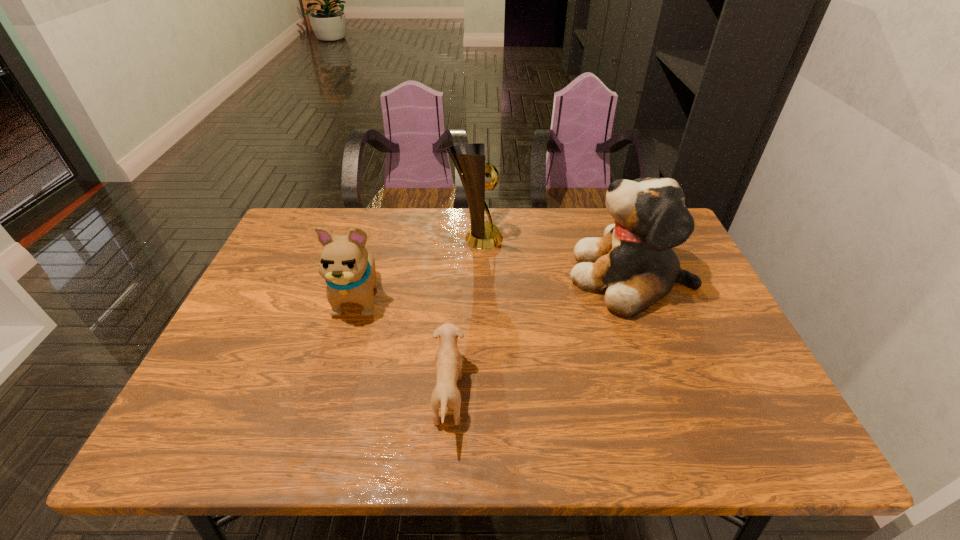
Locate an element on the screen. vacant area between the rightmost object and the leftmost object is located at coordinates (495, 286).

Identify the location of free spot between the third tallest object and the shortest puppy. (404, 346).

Where is `vacant space that is in between the rightmost object and the shortest puppy`? The width and height of the screenshot is (960, 540). vacant space that is in between the rightmost object and the shortest puppy is located at coordinates (540, 336).

Locate an element on the screen. The image size is (960, 540). vacant space in between the leftmost puppy and the shortest puppy is located at coordinates (404, 346).

Locate an element on the screen. the closest object to the nearest puppy is located at coordinates (349, 270).

The height and width of the screenshot is (540, 960). Find the location of `object that stands as the third closest to the award`. object that stands as the third closest to the award is located at coordinates (448, 362).

Select which puppy appears as the closest to the shortest puppy. Please provide its 2D coordinates. Your answer should be formatted as a tuple, i.e. [(x, y)], where the tuple contains the x and y coordinates of a point satisfying the conditions above.

[(349, 270)]

Identify which puppy is located as the second nearest to the rightmost object. Please provide its 2D coordinates. Your answer should be formatted as a tuple, i.e. [(x, y)], where the tuple contains the x and y coordinates of a point satisfying the conditions above.

[(349, 270)]

This screenshot has height=540, width=960. I want to click on blank area in the image that satisfies the following two spatial constraints: 1. at the front of the award, where the globe is visible; 2. on the face of the leftmost puppy, so click(x=476, y=296).

The height and width of the screenshot is (540, 960). In order to click on blank area in the image that satisfies the following two spatial constraints: 1. at the front of the award, where the globe is visible; 2. on the face of the third tallest object in this screenshot , I will do `click(476, 296)`.